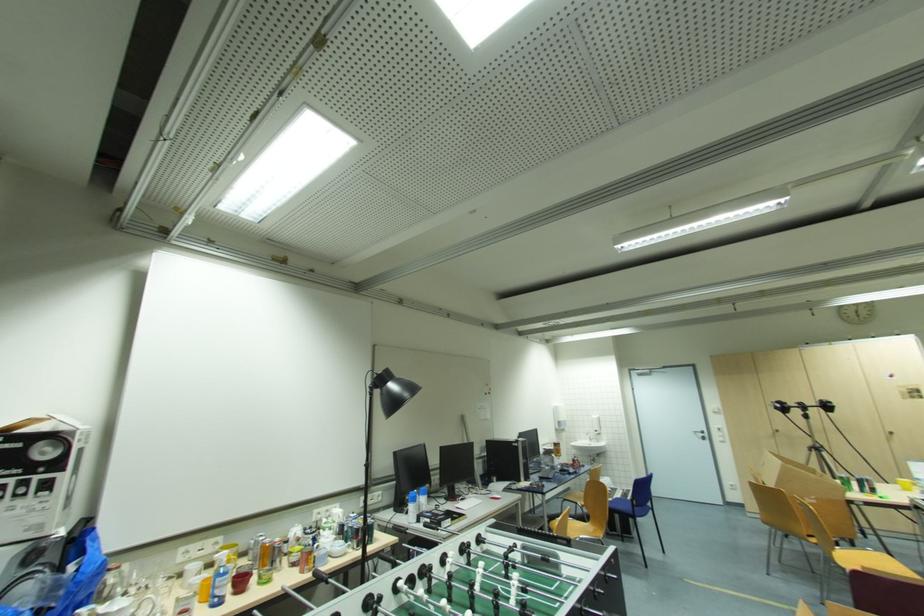
The image size is (924, 616). Find the location of `blue chair sitting surface`. blue chair sitting surface is located at coordinates (624, 507).